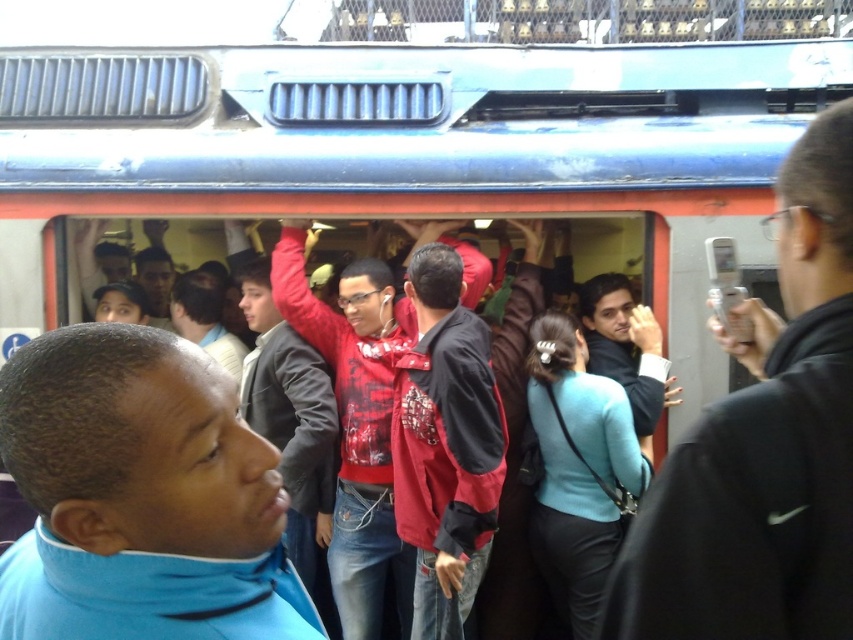
Can you confirm if red plaid shirt at center is positioned to the right of teal matte sweater at center?

Incorrect, red plaid shirt at center is not on the right side of teal matte sweater at center.

Is point (422, 316) behind point (558, 352)?

No, it is not.

Locate an element on the screen. red plaid shirt at center is located at coordinates (445, 445).

Is black leather jacket at right smaller than red shirt at center?

Actually, black leather jacket at right might be larger than red shirt at center.

Is black leather jacket at right to the left of red shirt at center from the viewer's perspective?

In fact, black leather jacket at right is to the right of red shirt at center.

Locate an element on the screen. The height and width of the screenshot is (640, 853). black leather jacket at right is located at coordinates (763, 445).

Who is taller, black leather jacket at right or red jacket at center?

red jacket at center

Does black leather jacket at right have a greater width compared to red jacket at center?

Yes, black leather jacket at right is wider than red jacket at center.

Find the location of a particular element. This screenshot has height=640, width=853. black leather jacket at right is located at coordinates 763,445.